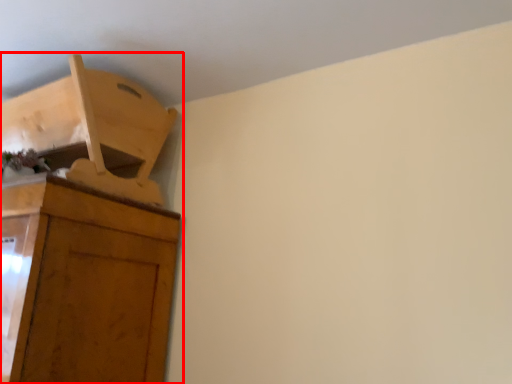
Question: From the image's perspective, where is cupboard (annotated by the red box) located in relation to furniture in the image?

Choices:
 (A) below
 (B) above

Answer: (A)